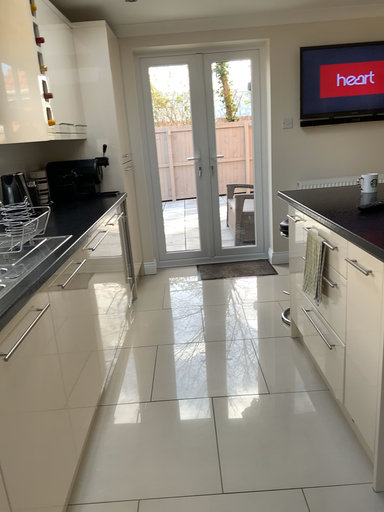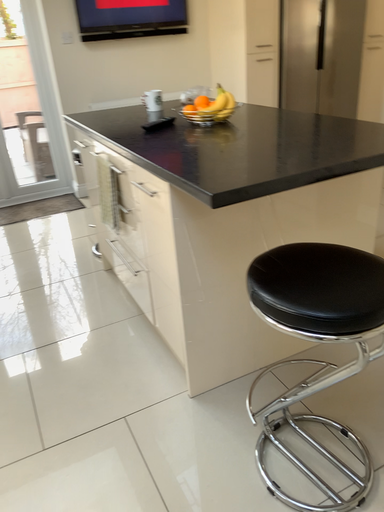
Question: Which way did the camera rotate in the video?

Choices:
 (A) rotated downward
 (B) rotated upward

Answer: (A)